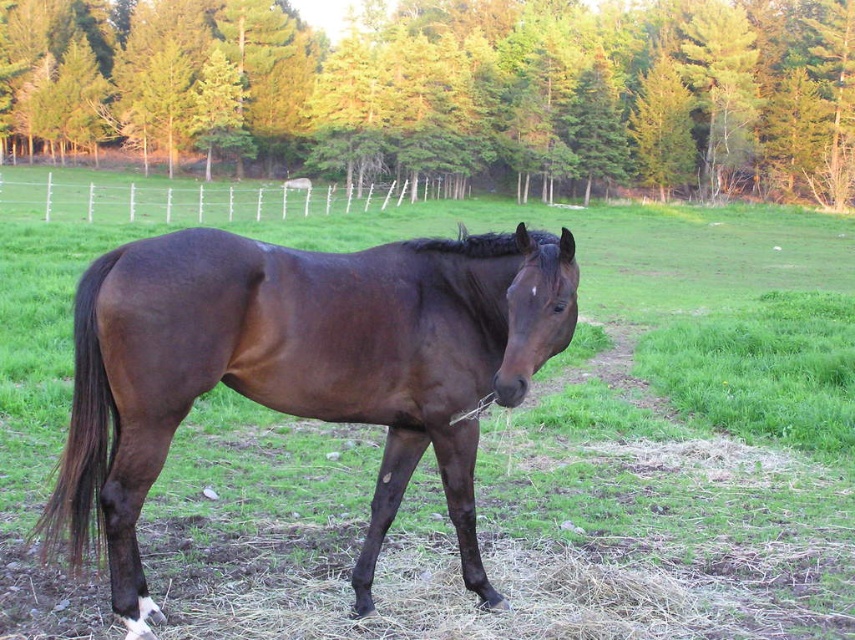
Question: Which of the following is the farthest from the observer?

Choices:
 (A) (783, 80)
 (B) (325, 397)

Answer: (A)

Question: Does green leafy trees at upper center appear on the left side of shiny brown horse at center?

Choices:
 (A) no
 (B) yes

Answer: (B)

Question: Which object is farther from the camera taking this photo?

Choices:
 (A) shiny brown horse at center
 (B) green leafy trees at upper center

Answer: (B)

Question: Which object is closer to the camera taking this photo?

Choices:
 (A) shiny brown horse at center
 (B) green leafy trees at upper center

Answer: (A)

Question: Does green leafy trees at upper center lie in front of shiny brown horse at center?

Choices:
 (A) yes
 (B) no

Answer: (B)

Question: Can you confirm if green leafy trees at upper center is thinner than shiny brown horse at center?

Choices:
 (A) yes
 (B) no

Answer: (B)